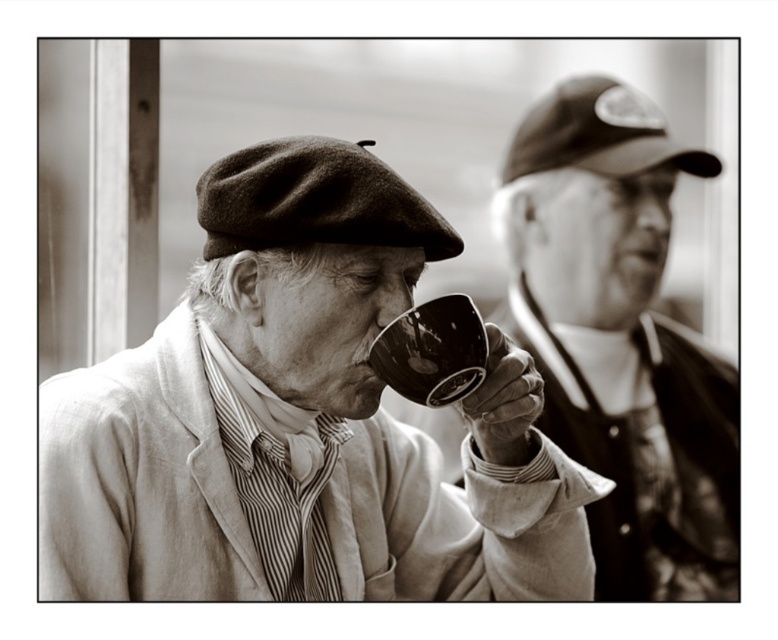
Based on the photo, is matte black cup at center bigger than matte black cup at right?

Actually, matte black cup at center might be smaller than matte black cup at right.

Who is more distant from viewer, (x=131, y=499) or (x=598, y=580)?

The point (x=598, y=580) is more distant.

Identify the location of matte black cup at center. (300, 420).

Can you confirm if matte black cup at center is wider than glossy ceramic mug at upper center?

Correct, the width of matte black cup at center exceeds that of glossy ceramic mug at upper center.

Consider the image. Does matte black cup at center have a lesser width compared to glossy ceramic mug at upper center?

No, matte black cup at center is not thinner than glossy ceramic mug at upper center.

Consider the image. Who is more distant from viewer, (249, 243) or (428, 384)?

Point (249, 243)

Where is `matte black cup at center`? matte black cup at center is located at coordinates (300, 420).

What do you see at coordinates (619, 339) in the screenshot? I see `matte black cup at right` at bounding box center [619, 339].

Measure the distance between point (626,483) and camera.

Point (626,483) and camera are 9.67 feet apart from each other.

Where is `matte black cup at right`? matte black cup at right is located at coordinates (619, 339).